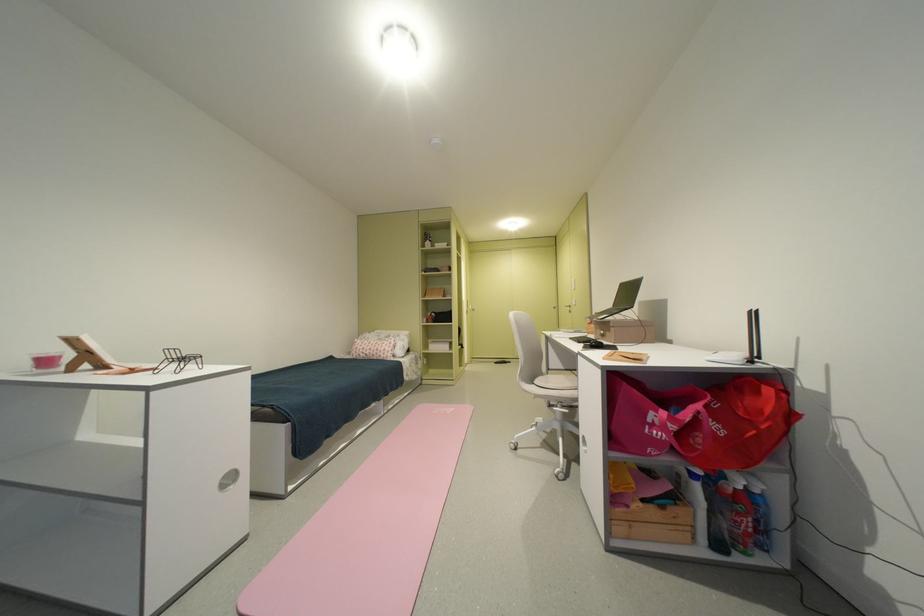
At what (x,y) coordinates should I click in order to perform the action: click on pink yoga mat. Please return your answer as a coordinate pair (x, y). The width and height of the screenshot is (924, 616). Looking at the image, I should click on (370, 528).